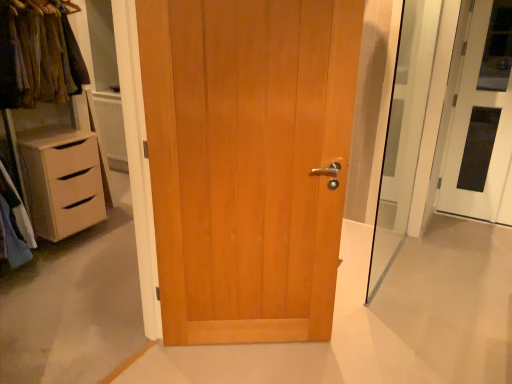
Find the location of a particular element. free space between white glossy door at right, the 2th door positioned from the left, and transparent glass screen door at right is located at coordinates (439, 243).